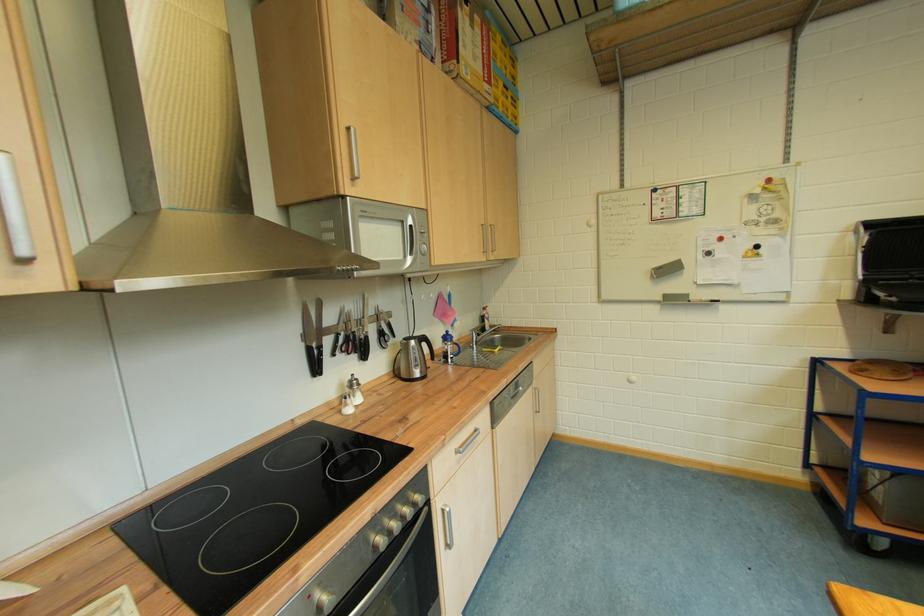
The height and width of the screenshot is (616, 924). What are the coordinates of `microwave button` in the screenshot? It's located at (380, 541).